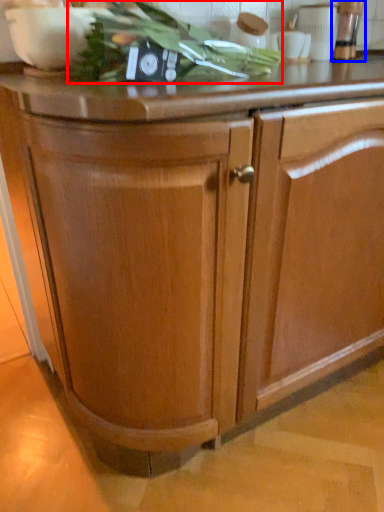
Question: Which object appears farthest to the camera in this image, vegetable (highlighted by a red box) or appliance (highlighted by a blue box)?

Choices:
 (A) vegetable
 (B) appliance

Answer: (B)